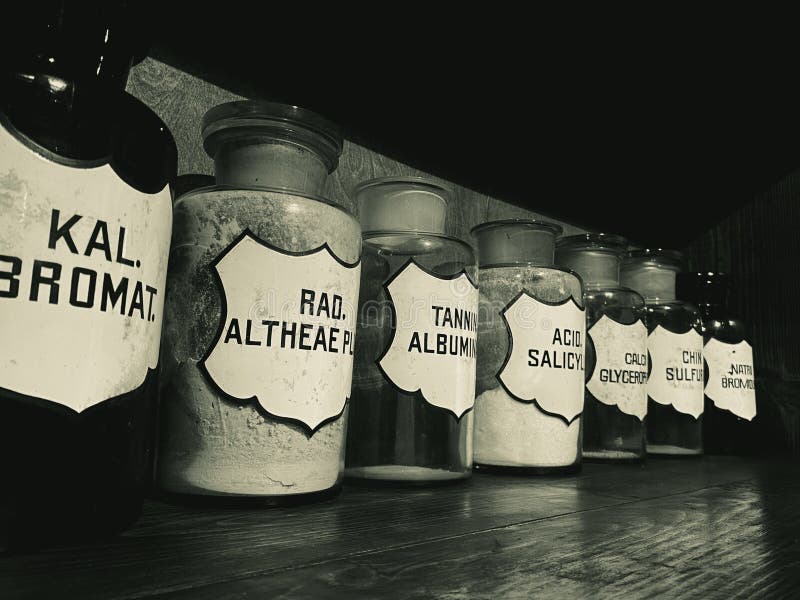
Find the location of a particular element. The image size is (800, 600). shelf is located at coordinates (433, 526).